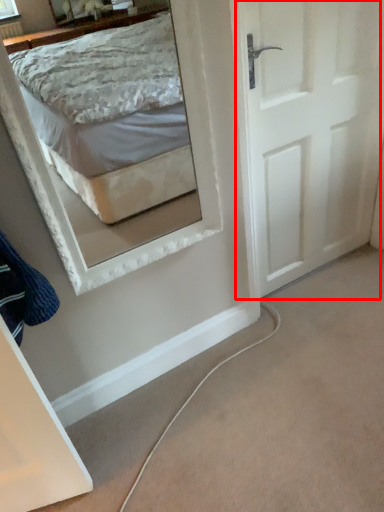
Question: From the image's perspective, what is the correct spatial relationship of door (annotated by the red box) in relation to clothe?

Choices:
 (A) above
 (B) below

Answer: (A)